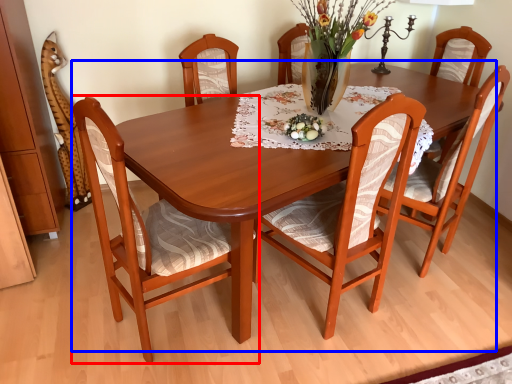
Question: Which point is closer to the camera, chair (highlighted by a red box) or kitchen & dining room table (highlighted by a blue box)?

Choices:
 (A) chair
 (B) kitchen & dining room table

Answer: (B)